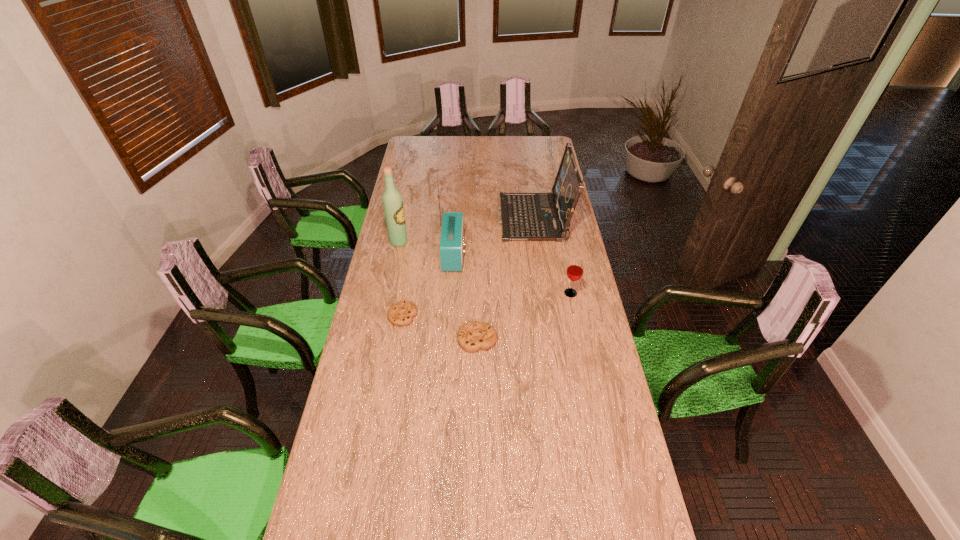
Find the location of a particular element. Image resolution: width=960 pixels, height=540 pixels. glass situated at the right edge is located at coordinates (574, 272).

You are a GUI agent. You are given a task and a screenshot of the screen. Output one action in this format:
    pyautogui.click(x=<x>, y=<y>)
    Task: Click on the vacant space at the far edge of the desktop
    
    Given the screenshot: What is the action you would take?
    pyautogui.click(x=472, y=139)

This screenshot has height=540, width=960. In the image, there is a desktop. In order to click on free space at the near edge in this screenshot , I will do `click(448, 501)`.

You are a GUI agent. You are given a task and a screenshot of the screen. Output one action in this format:
    pyautogui.click(x=<x>, y=<y>)
    Task: Click on the vacant area at the left edge
    The width and height of the screenshot is (960, 540).
    Given the screenshot: What is the action you would take?
    pos(412,227)

Find the location of a particular element. This screenshot has width=960, height=540. vacant space at the right edge is located at coordinates (542, 170).

In the image, there is a desktop. Identify the location of vacant region at the far left corner. (415, 147).

At what (x,y) coordinates should I click in order to perform the action: click on vacant space at the far right corner of the desktop. Please return your answer as a coordinate pair (x, y). Image resolution: width=960 pixels, height=540 pixels. Looking at the image, I should click on (x=553, y=144).

Where is `vacant space that is in between the radio receiver and the fourth tallest object`? vacant space that is in between the radio receiver and the fourth tallest object is located at coordinates (512, 273).

Locate an element on the screen. The image size is (960, 540). vacant space that's between the taller cookie and the laptop computer is located at coordinates coord(506,279).

I want to click on free point between the laptop computer and the shorter cookie, so click(468, 267).